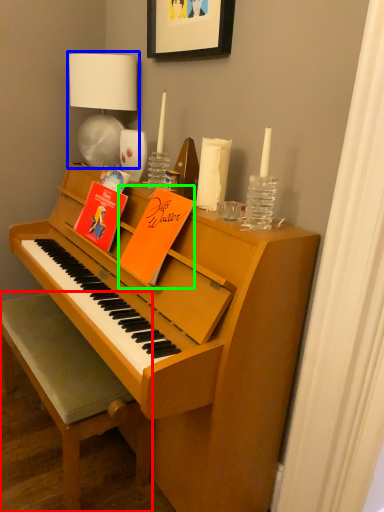
Question: Which is nearer to the chair (highlighted by a red box)? table lamp (highlighted by a blue box) or paperback book (highlighted by a green box).

Choices:
 (A) table lamp
 (B) paperback book

Answer: (B)